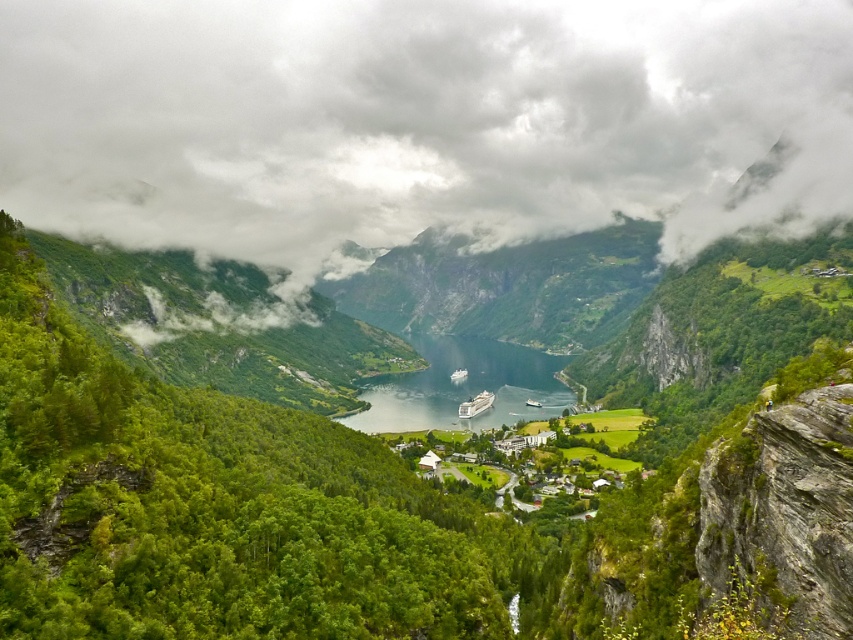
Question: Among these points, which one is farthest from the camera?

Choices:
 (A) (368, 19)
 (B) (467, 412)
 (C) (426, 381)

Answer: (A)

Question: Can you confirm if cloudy sky at center is thinner than white glossy cruise ship at center?

Choices:
 (A) yes
 (B) no

Answer: (B)

Question: Does clear blue water at center appear on the right side of white glossy cruise ship at center?

Choices:
 (A) no
 (B) yes

Answer: (A)

Question: Estimate the real-world distances between objects in this image. Which object is closer to the clear blue water at center?

Choices:
 (A) cloudy sky at center
 (B) white glossy cruise ship at center

Answer: (B)

Question: Does cloudy sky at center have a smaller size compared to white glossy cruise ship at center?

Choices:
 (A) no
 (B) yes

Answer: (A)

Question: Considering the real-world distances, which object is closest to the white glossy cruise ship at center?

Choices:
 (A) cloudy sky at center
 (B) clear blue water at center

Answer: (B)